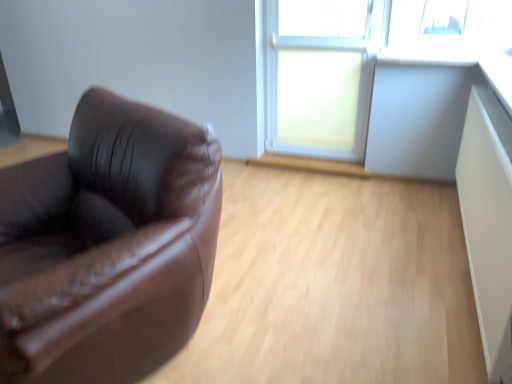
Describe the element at coordinates (315, 82) in the screenshot. I see `white plastic window frame at upper right` at that location.

The height and width of the screenshot is (384, 512). In order to click on white plastic window frame at upper right in this screenshot , I will do `click(315, 82)`.

This screenshot has height=384, width=512. I want to click on matte glass window at center, so click(317, 97).

In order to face matte glass window at center, should I rotate leftwards or rightwards?

You should rotate right by 7.836 degrees.

Describe the element at coordinates (317, 97) in the screenshot. The height and width of the screenshot is (384, 512). I see `matte glass window at center` at that location.

You are a GUI agent. You are given a task and a screenshot of the screen. Output one action in this format:
    pyautogui.click(x=<x>, y=<y>)
    Task: Click on the white plastic window frame at upper right
    The height and width of the screenshot is (384, 512).
    Given the screenshot: What is the action you would take?
    pyautogui.click(x=315, y=82)

Which object is positioned more to the right, matte glass window at center or white plastic window frame at upper right?

white plastic window frame at upper right.

In the image, is matte glass window at center positioned in front of or behind white plastic window frame at upper right?

Visually, matte glass window at center is located behind white plastic window frame at upper right.

Which point is more forward, (349, 116) or (334, 23)?

The point (349, 116) is closer to the camera.

From the image's perspective, is matte glass window at center located beneath white plastic window frame at upper right?

Correct, matte glass window at center appears lower than white plastic window frame at upper right in the image.

From a real-world perspective, between matte glass window at center and white plastic window frame at upper right, who is vertically higher?

white plastic window frame at upper right.

Considering the sizes of objects matte glass window at center and white plastic window frame at upper right in the image provided, who is thinner, matte glass window at center or white plastic window frame at upper right?

Thinner between the two is matte glass window at center.

Between matte glass window at center and white plastic window frame at upper right, which one has less height?

With less height is matte glass window at center.

Between matte glass window at center and white plastic window frame at upper right, which one has smaller size?

matte glass window at center is smaller.

Is white plastic window frame at upper right surrounded by matte glass window at center?

Absolutely, white plastic window frame at upper right is inside matte glass window at center.

Is matte glass window at center touching white plastic window frame at upper right?

Indeed, matte glass window at center and white plastic window frame at upper right are beside each other and touching.

Is matte glass window at center oriented away from white plastic window frame at upper right?

Absolutely, matte glass window at center is directed away from white plastic window frame at upper right.

What's the angular difference between matte glass window at center and white plastic window frame at upper right's facing directions?

The facing directions of matte glass window at center and white plastic window frame at upper right are 0.609 degrees apart.

This screenshot has width=512, height=384. Identify the location of window frame above the matte glass window at center (from a real-world perspective). (315, 82).

Which is more to the right, white plastic window frame at upper right or matte glass window at center?

From the viewer's perspective, white plastic window frame at upper right appears more on the right side.

Between white plastic window frame at upper right and matte glass window at center, which one is positioned in front?

Positioned in front is white plastic window frame at upper right.

Is point (351, 95) closer to viewer compared to point (297, 55)?

No, it is behind (297, 55).

From the image's perspective, would you say white plastic window frame at upper right is positioned over matte glass window at center?

Yes, from the image's perspective, white plastic window frame at upper right is on top of matte glass window at center.

From a real-world perspective, is white plastic window frame at upper right on top of matte glass window at center?

Yes, from a real-world perspective, white plastic window frame at upper right is on top of matte glass window at center.

Does white plastic window frame at upper right have a lesser width compared to matte glass window at center?

In fact, white plastic window frame at upper right might be wider than matte glass window at center.

Considering the relative sizes of white plastic window frame at upper right and matte glass window at center in the image provided, is white plastic window frame at upper right taller than matte glass window at center?

Yes, white plastic window frame at upper right is taller than matte glass window at center.

In terms of size, does white plastic window frame at upper right appear bigger or smaller than matte glass window at center?

white plastic window frame at upper right is bigger than matte glass window at center.

Looking at this image, can matte glass window at center be found inside white plastic window frame at upper right?

Yes, matte glass window at center can be found within white plastic window frame at upper right.

Is white plastic window frame at upper right with matte glass window at center?

Yes, white plastic window frame at upper right is with matte glass window at center.

Could you tell me if white plastic window frame at upper right is facing matte glass window at center?

Yes, white plastic window frame at upper right is oriented towards matte glass window at center.

Can you tell me how much white plastic window frame at upper right and matte glass window at center differ in facing direction?

They differ by 0.609 degrees in their facing directions.

Locate an element on the screen. This screenshot has height=384, width=512. window below the white plastic window frame at upper right (from a real-world perspective) is located at coordinates (317, 97).

This screenshot has width=512, height=384. I want to click on window behind the white plastic window frame at upper right, so click(317, 97).

At what (x,y) coordinates should I click in order to perform the action: click on window frame lying on the right of matte glass window at center. Please return your answer as a coordinate pair (x, y). The height and width of the screenshot is (384, 512). Looking at the image, I should click on (315, 82).